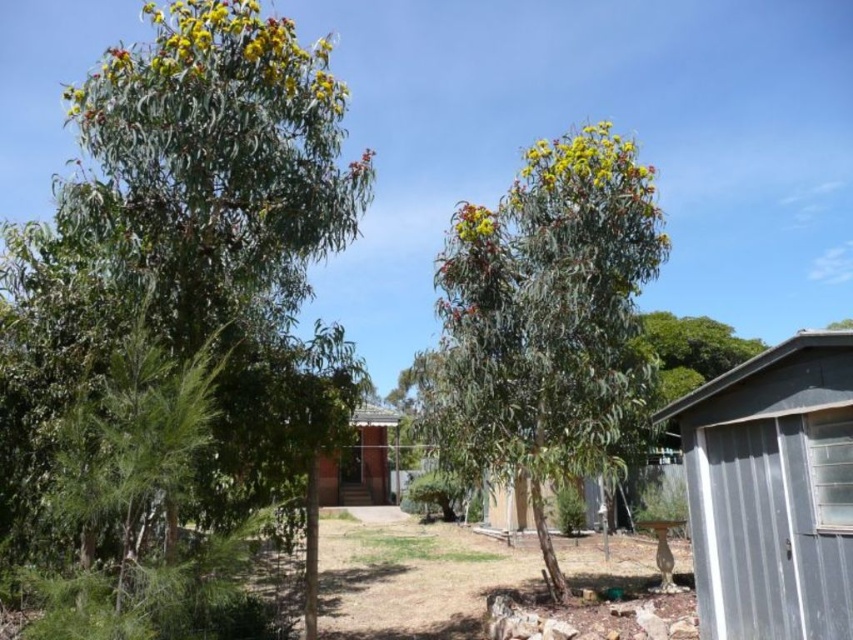
Measure the distance between green leafy tree at center and brown wood hut at center.

green leafy tree at center is 4.02 meters from brown wood hut at center.

Based on the photo, does green leafy tree at center have a smaller size compared to brown wood hut at center?

Yes, green leafy tree at center is smaller than brown wood hut at center.

The width and height of the screenshot is (853, 640). I want to click on green leafy tree at center, so click(547, 317).

Measure the distance between point (178,64) and camera.

Point (178,64) is 17.34 feet from camera.

Can you confirm if green glossy tree at center is positioned to the left of brown wood hut at center?

Correct, you'll find green glossy tree at center to the left of brown wood hut at center.

Between point (177, 275) and point (334, 499), which one is positioned in front?

Positioned in front is point (177, 275).

At what (x,y) coordinates should I click in order to perform the action: click on green glossy tree at center. Please return your answer as a coordinate pair (x, y). The image size is (853, 640). Looking at the image, I should click on (193, 241).

Between green glossy tree at center and green leafy tree at center, which one is positioned lower?

green leafy tree at center is below.

What do you see at coordinates (193, 241) in the screenshot? I see `green glossy tree at center` at bounding box center [193, 241].

Is point (85, 349) positioned after point (462, 321)?

No.

I want to click on green glossy tree at center, so click(193, 241).